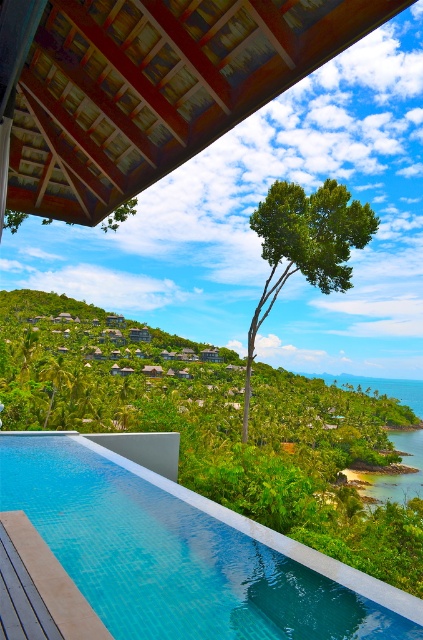
Describe the element at coordinates (181, 554) in the screenshot. I see `clear glass pool at center` at that location.

Between point (181, 512) and point (280, 204), which one is positioned behind?

Point (280, 204)

Is point (282, 568) farther from viewer compared to point (349, 205)?

That is False.

Identify the location of clear glass pool at center. This screenshot has width=423, height=640. (181, 554).